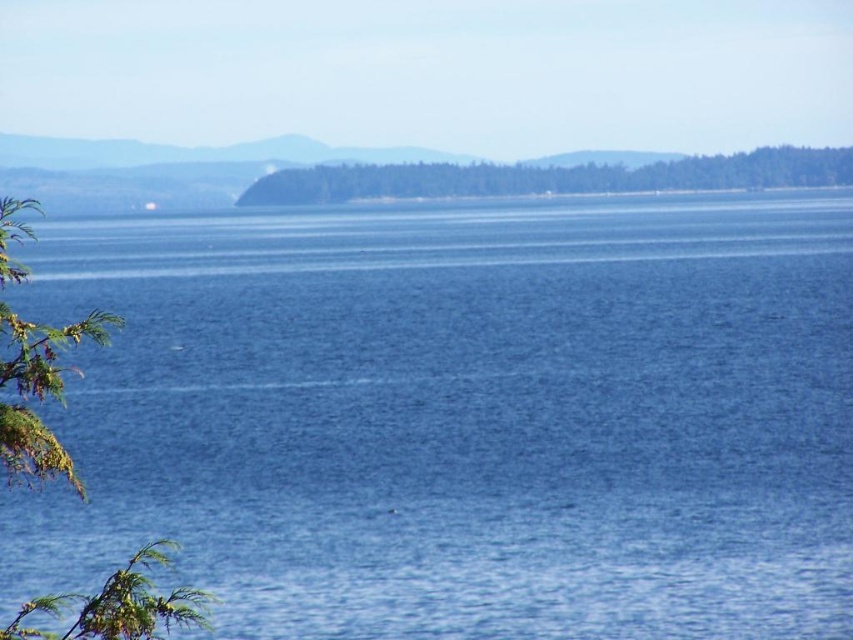
You are an artist trying to paint this coastal scene. You want to ensure the green leafy branch at left and the green leafy tree at center are proportionally accurate. Which one should you draw wider in your painting?

The green leafy tree at center should be drawn wider because the green leafy branch at left is narrower than the green leafy tree at center according to the description.

You are a bird flying over the coastal landscape. You see the green leafy branch at left and the green leafy tree at center. Which one is closer to the water?

The green leafy branch at left is located below the green leafy tree at center, so it is closer to the water.